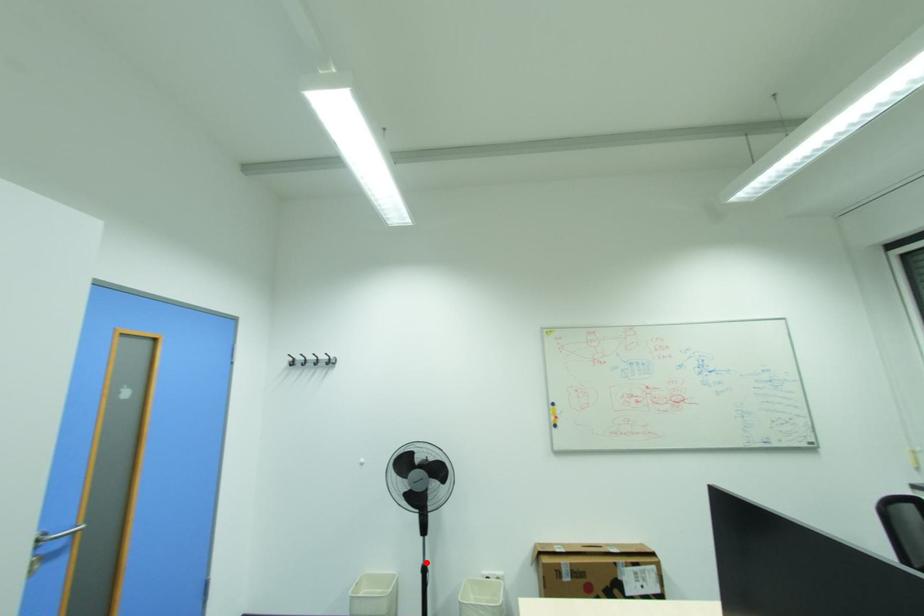
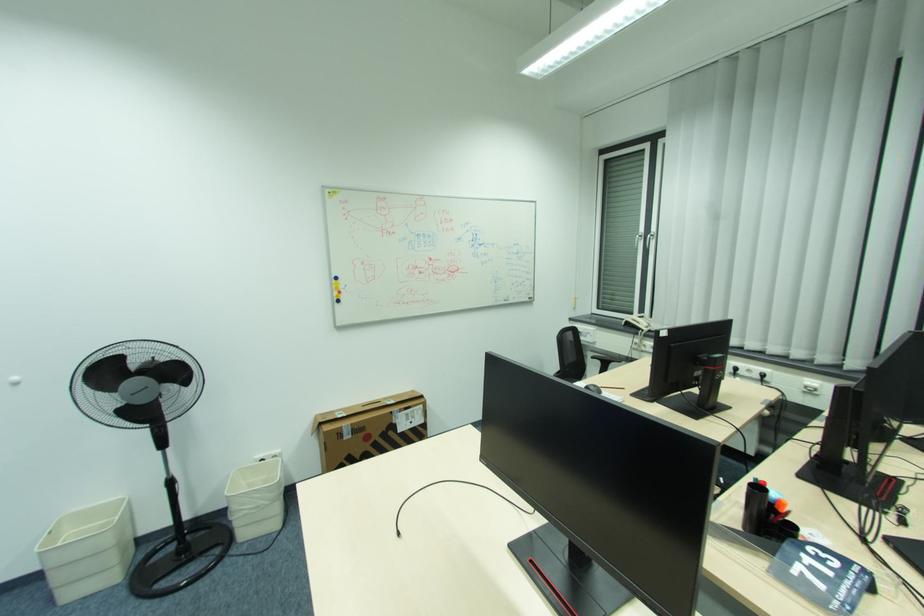
Question: I am providing you with two images of the same scene from different viewpoints. A red point is shown in image1. For the corresponding object point in image2, is it positioned nearer or farther from the camera?

Choices:
 (A) Nearer
 (B) Farther

Answer: (A)